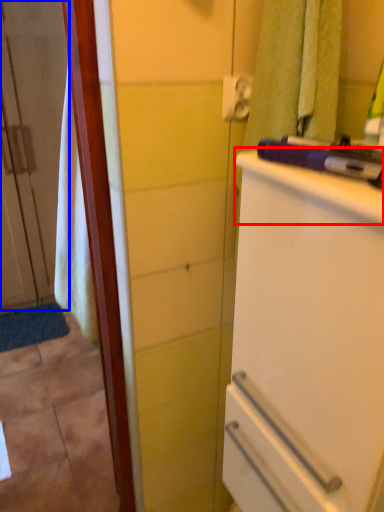
Question: Among these objects, which one is nearest to the camera, counter top (highlighted by a red box) or door (highlighted by a blue box)?

Choices:
 (A) counter top
 (B) door

Answer: (A)